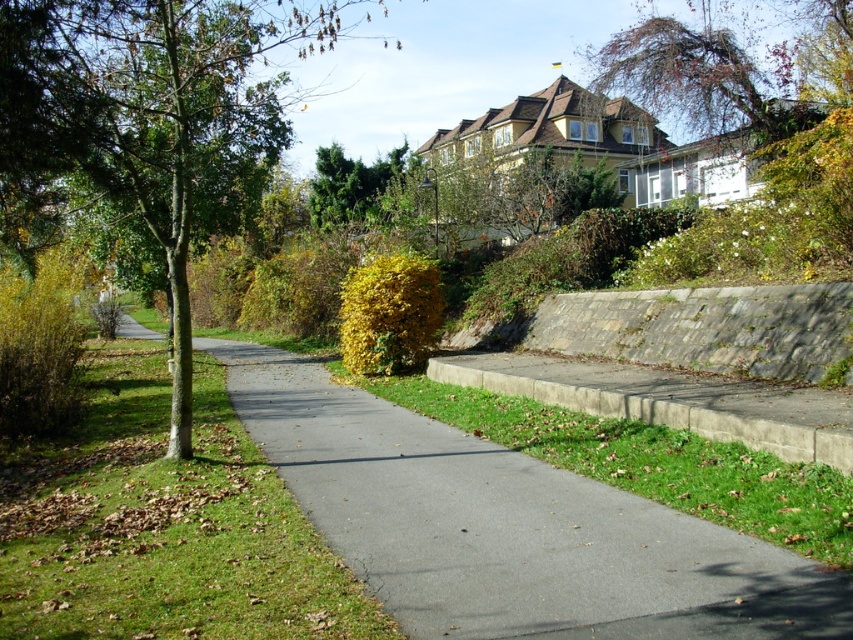
Is point (529, 593) behind point (843, 428)?

No, it is not.

Is gray asphalt pavement at center smaller than gray concrete curb at lower right?

Actually, gray asphalt pavement at center might be larger than gray concrete curb at lower right.

You are a GUI agent. You are given a task and a screenshot of the screen. Output one action in this format:
    pyautogui.click(x=<x>, y=<y>)
    Task: Click on the gray asphalt pavement at center
    This screenshot has height=640, width=853.
    Given the screenshot: What is the action you would take?
    pyautogui.click(x=508, y=525)

Is the position of gray asphalt pavement at center less distant than that of green grass at left?

Yes, it is in front of green grass at left.

Does gray asphalt pavement at center have a lesser width compared to green grass at left?

Yes, gray asphalt pavement at center is thinner than green grass at left.

Is point (734, 596) positioned before point (270, 499)?

Yes, it is in front of point (270, 499).

The width and height of the screenshot is (853, 640). Identify the location of gray asphalt pavement at center. (508, 525).

Between gray asphalt pavement at center and green smooth tree at left, which one is positioned higher?

green smooth tree at left is above.

Who is positioned more to the left, gray asphalt pavement at center or green smooth tree at left?

From the viewer's perspective, green smooth tree at left appears more on the left side.

Measure the distance between gray asphalt pavement at center and camera.

4.09 meters

This screenshot has height=640, width=853. In order to click on gray asphalt pavement at center in this screenshot , I will do `click(508, 525)`.